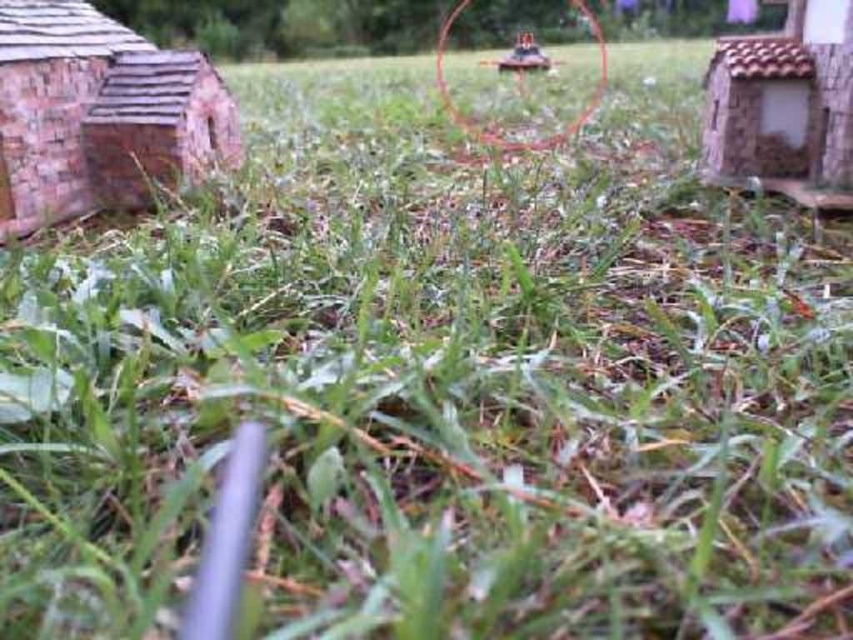
Is brick textured hut at left shorter than rustic stone hut at right?

No.

Does brick textured hut at left have a larger size compared to rustic stone hut at right?

Indeed, brick textured hut at left has a larger size compared to rustic stone hut at right.

You are a GUI agent. You are given a task and a screenshot of the screen. Output one action in this format:
    pyautogui.click(x=<x>, y=<y>)
    Task: Click on the brick textured hut at left
    
    Given the screenshot: What is the action you would take?
    pyautogui.click(x=97, y=113)

Is point (724, 172) farther from camera compared to point (527, 144)?

No.

Who is more forward, (799,128) or (592,100)?

Point (799,128) is in front.

This screenshot has width=853, height=640. I want to click on rustic stone hut at right, so click(x=785, y=106).

Does point (781, 180) come in front of point (509, 52)?

Yes.

Is rustic stone hut at right positioned behind metallic green toy tank at upper center?

That is False.

Is point (720, 112) closer to camera compared to point (548, 60)?

Yes, point (720, 112) is in front of point (548, 60).

Find the location of a particular element. The image size is (853, 640). rustic stone hut at right is located at coordinates (785, 106).